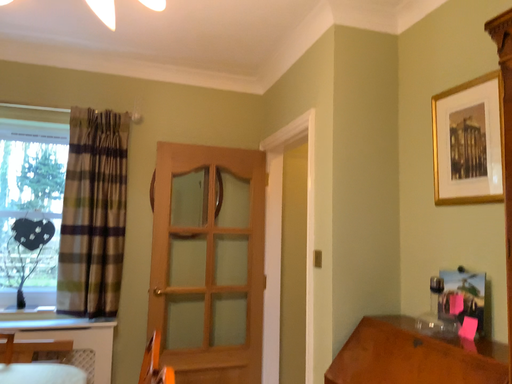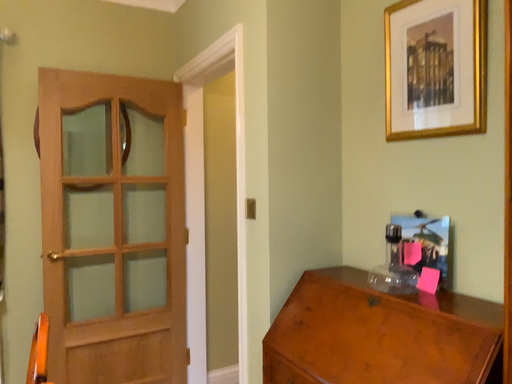
Question: Which way did the camera rotate in the video?

Choices:
 (A) rotated downward
 (B) rotated upward

Answer: (A)